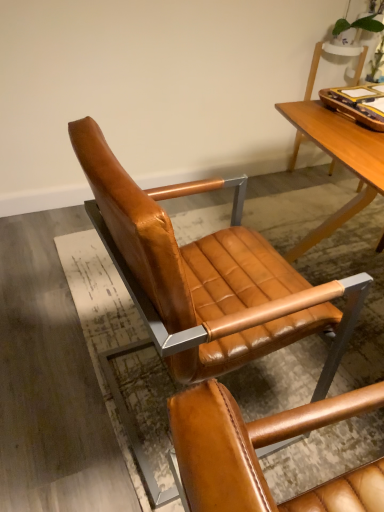
Question: Can you confirm if cognac leather chair at center is wider than brown leather tray at upper right?

Choices:
 (A) no
 (B) yes

Answer: (B)

Question: Is cognac leather chair at center outside brown leather tray at upper right?

Choices:
 (A) yes
 (B) no

Answer: (A)

Question: Considering the relative sizes of cognac leather chair at center and brown leather tray at upper right in the image provided, is cognac leather chair at center smaller than brown leather tray at upper right?

Choices:
 (A) no
 (B) yes

Answer: (A)

Question: Can you confirm if cognac leather chair at center is taller than brown leather tray at upper right?

Choices:
 (A) yes
 (B) no

Answer: (A)

Question: Can you confirm if cognac leather chair at center is bigger than brown leather tray at upper right?

Choices:
 (A) no
 (B) yes

Answer: (B)

Question: Is cognac leather chair at center to the right of brown leather tray at upper right from the viewer's perspective?

Choices:
 (A) yes
 (B) no

Answer: (B)

Question: Considering the relative sizes of brown leather tray at upper right and cognac leather chair at center in the image provided, is brown leather tray at upper right smaller than cognac leather chair at center?

Choices:
 (A) no
 (B) yes

Answer: (B)

Question: Does brown leather tray at upper right have a larger size compared to cognac leather chair at center?

Choices:
 (A) no
 (B) yes

Answer: (A)

Question: Is cognac leather chair at center at the back of brown leather tray at upper right?

Choices:
 (A) no
 (B) yes

Answer: (A)

Question: From the image's perspective, is brown leather tray at upper right under cognac leather chair at center?

Choices:
 (A) no
 (B) yes

Answer: (A)

Question: Considering the relative positions of brown leather tray at upper right and cognac leather chair at center in the image provided, is brown leather tray at upper right in front of cognac leather chair at center?

Choices:
 (A) no
 (B) yes

Answer: (A)

Question: Can you confirm if brown leather tray at upper right is taller than cognac leather chair at center?

Choices:
 (A) yes
 (B) no

Answer: (B)

Question: From a real-world perspective, is cognac leather chair at center physically located above or below brown leather tray at upper right?

Choices:
 (A) above
 (B) below

Answer: (B)